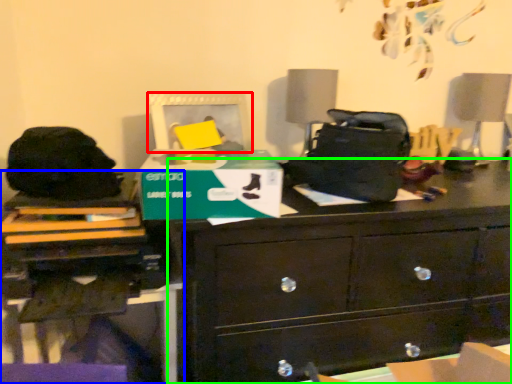
Question: Which is nearer to the picture frame (highlighted by a red box)? computer desk (highlighted by a blue box) or chest of drawers (highlighted by a green box).

Choices:
 (A) computer desk
 (B) chest of drawers

Answer: (A)